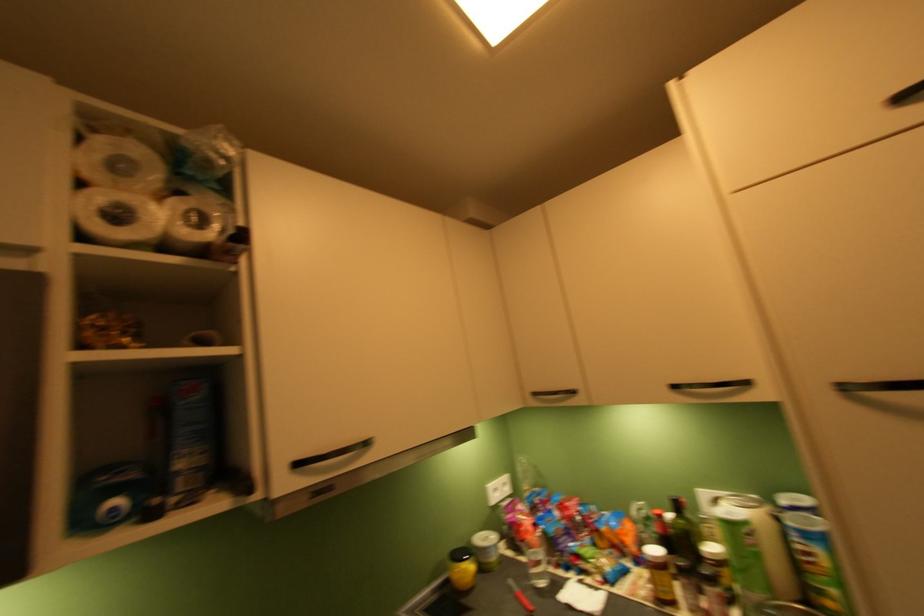
This screenshot has width=924, height=616. In order to click on red knife handle in this screenshot , I will do `click(520, 597)`.